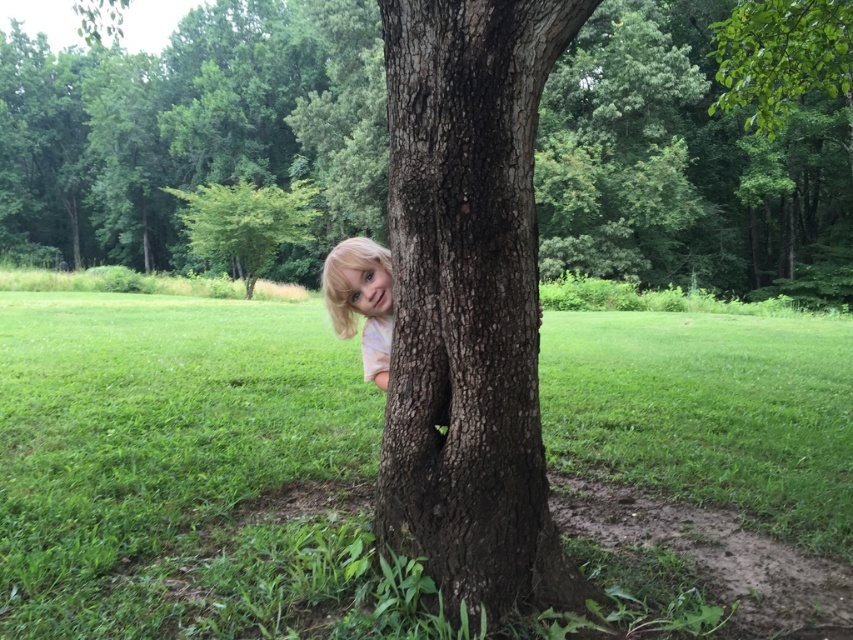
Between brown rough tree trunk at center and green leafy bush at upper left, which one appears on the right side from the viewer's perspective?

brown rough tree trunk at center is more to the right.

Between brown rough tree trunk at center and green leafy bush at upper left, which one has less height?

Standing shorter between the two is brown rough tree trunk at center.

Does point (486, 288) come farther from viewer compared to point (257, 253)?

No, it is not.

In order to click on brown rough tree trunk at center in this screenshot , I will do `click(469, 301)`.

Is brown rough bark tree at center smaller than blonde hair at tree?

No.

You are a GUI agent. You are given a task and a screenshot of the screen. Output one action in this format:
    pyautogui.click(x=<x>, y=<y>)
    Task: Click on the brown rough bark tree at center
    The height and width of the screenshot is (640, 853).
    Given the screenshot: What is the action you would take?
    pyautogui.click(x=190, y=131)

Which is behind, point (669, 61) or point (454, 394)?

Point (669, 61)

Can you confirm if brown rough bark tree at center is bigger than brown rough tree trunk at center?

Yes.

This screenshot has width=853, height=640. I want to click on brown rough bark tree at center, so click(190, 131).

Where is `brown rough bark tree at center`? The image size is (853, 640). brown rough bark tree at center is located at coordinates (190, 131).